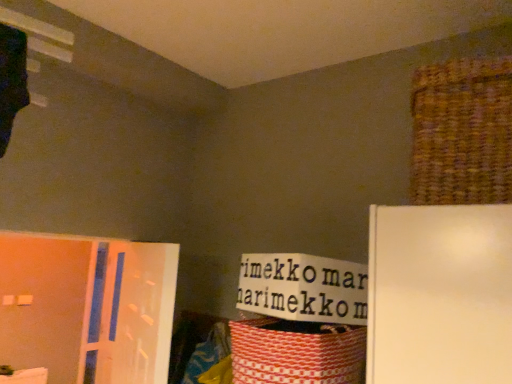
Question: From the image's perspective, is red woven basket at lower right, positioned as the second basket in right-to-left order, on top of brown woven basket at upper right, which appears as the 1th basket when viewed from the top?

Choices:
 (A) yes
 (B) no

Answer: (B)

Question: Is red woven basket at lower right, marked as the 2th basket in a top-to-bottom arrangement, completely or partially outside of brown woven basket at upper right, the first basket when ordered from right to left?

Choices:
 (A) no
 (B) yes

Answer: (B)

Question: From a real-world perspective, is red woven basket at lower right, marked as the 1th basket in a bottom-to-top arrangement, on top of brown woven basket at upper right, which is the 2th basket from bottom to top?

Choices:
 (A) no
 (B) yes

Answer: (A)

Question: Is red woven basket at lower right, positioned as the second basket in right-to-left order, bigger than brown woven basket at upper right, which is the 2th basket from bottom to top?

Choices:
 (A) no
 (B) yes

Answer: (A)

Question: Is red woven basket at lower right, which is the 1th basket from left to right, not close to brown woven basket at upper right, which appears as the 1th basket when viewed from the top?

Choices:
 (A) no
 (B) yes

Answer: (A)

Question: From a real-world perspective, is translucent plastic screen door at left positioned above or below red woven basket at lower right, marked as the 2th basket in a top-to-bottom arrangement?

Choices:
 (A) above
 (B) below

Answer: (B)

Question: Considering the positions of point (105, 316) and point (238, 326), is point (105, 316) closer or farther from the camera than point (238, 326)?

Choices:
 (A) closer
 (B) farther

Answer: (B)

Question: Considering their positions, is translucent plastic screen door at left located in front of or behind red woven basket at lower right, marked as the 2th basket in a top-to-bottom arrangement?

Choices:
 (A) behind
 (B) front

Answer: (A)

Question: Based on their sizes in the image, would you say translucent plastic screen door at left is bigger or smaller than red woven basket at lower right, positioned as the second basket in right-to-left order?

Choices:
 (A) big
 (B) small

Answer: (A)

Question: From a real-world perspective, is translucent plastic screen door at left positioned above or below brown woven basket at upper right, which appears as the 1th basket when viewed from the top?

Choices:
 (A) above
 (B) below

Answer: (B)

Question: From the image's perspective, relative to brown woven basket at upper right, the first basket when ordered from right to left, is translucent plastic screen door at left above or below?

Choices:
 (A) below
 (B) above

Answer: (A)

Question: Does point (151, 306) appear closer or farther from the camera than point (472, 187)?

Choices:
 (A) closer
 (B) farther

Answer: (B)

Question: Is translucent plastic screen door at left to the left or to the right of brown woven basket at upper right, which is the 2th basket from bottom to top, in the image?

Choices:
 (A) right
 (B) left

Answer: (B)

Question: In terms of height, does red woven basket at lower right, marked as the 1th basket in a bottom-to-top arrangement, look taller or shorter compared to brown woven basket at upper right, which appears as the 1th basket when viewed from the top?

Choices:
 (A) tall
 (B) short

Answer: (B)

Question: Considering their positions, is red woven basket at lower right, which is the 1th basket from left to right, located in front of or behind brown woven basket at upper right, which appears as the 1th basket when viewed from the top?

Choices:
 (A) front
 (B) behind

Answer: (B)